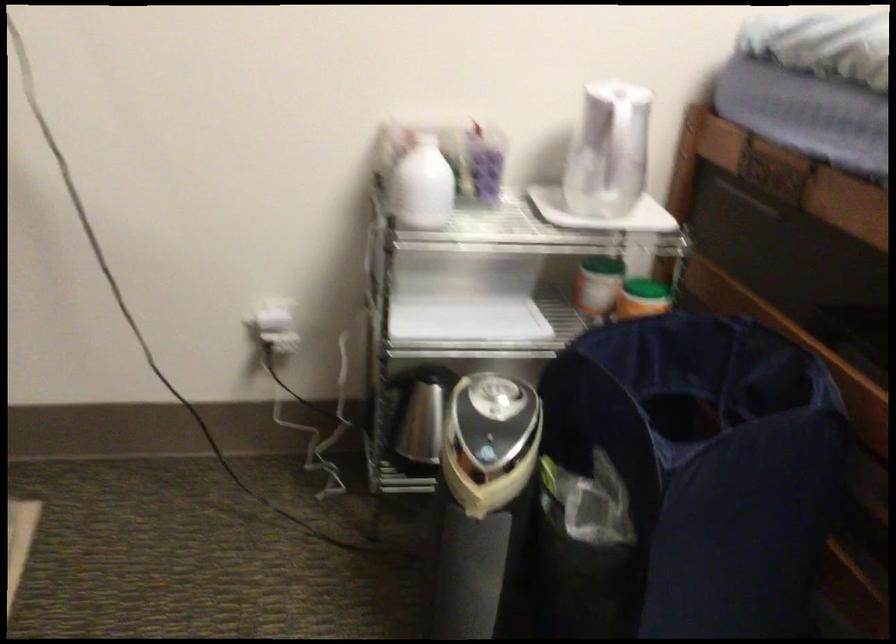
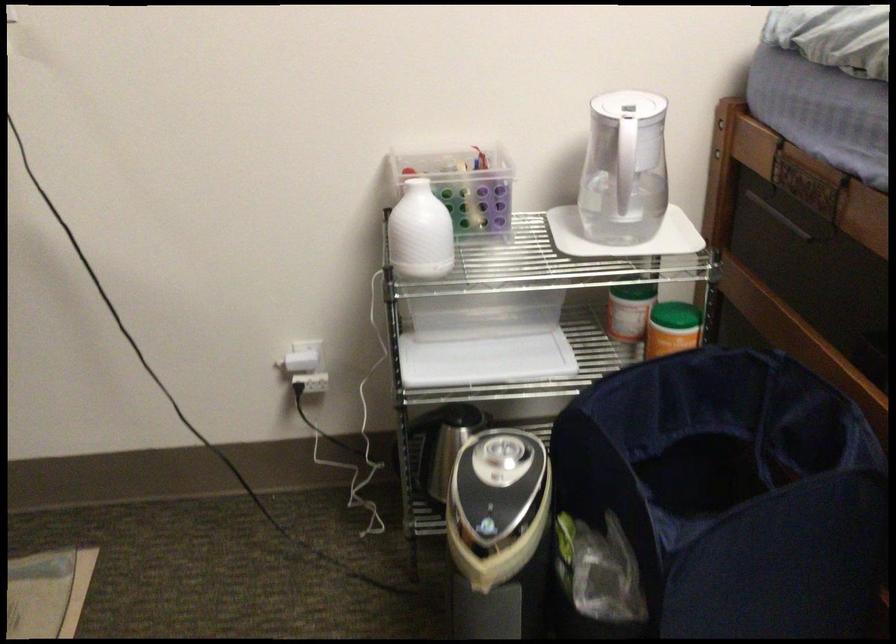
In the second image, find the point that corresponds to (462,152) in the first image.

(463, 185)